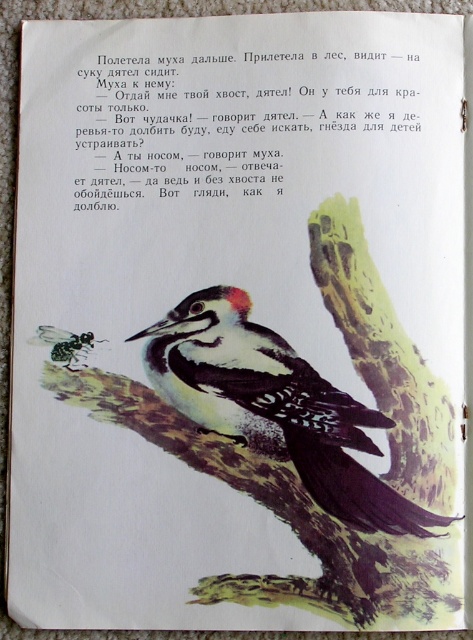
You are an ornithologist examining the image of a woodpecker. The coordinates given are in the normalized image coordinate system where the origin is at the bottom left corner. The woodpecker is located at point (x=274, y=406). If you were to draw a line from the woodpecker to the top edge of the image, would this line cross any other object besides the woodpecker itself?

The image description does not mention any other objects along the path from the woodpecker at point (x=274, y=406) to the top edge, so it is likely the line would not cross any other objects besides the woodpecker itself.

In the scene from the childrens book, there is a speckled feathered woodpecker at center and a black glossy ant at lower left. Which of these two creatures is larger in size?

The speckled feathered woodpecker at center is much taller than the black glossy ant at lower left.